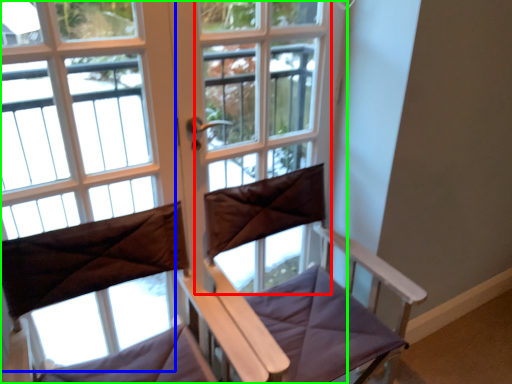
Question: Estimate the real-world distances between objects in this image. Which object is farther from screen door (highlighted by a red box), bay window (highlighted by a blue box) or window (highlighted by a green box)?

Choices:
 (A) bay window
 (B) window

Answer: (A)